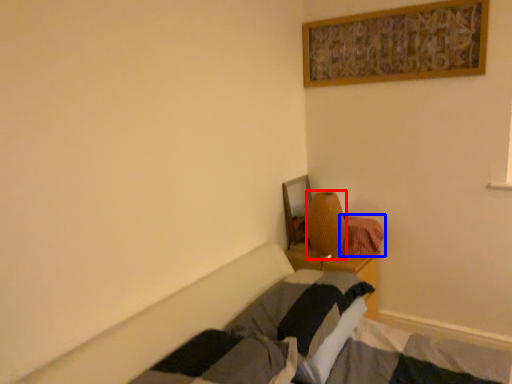
Question: Which object appears farthest to the camera in this image, lamp (highlighted by a red box) or blanket (highlighted by a blue box)?

Choices:
 (A) lamp
 (B) blanket

Answer: (B)